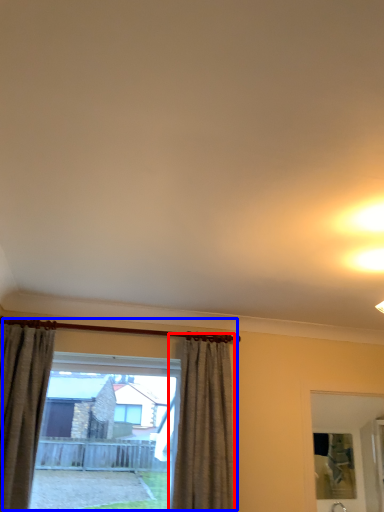
Question: Which object is closer to the camera taking this photo, curtain (highlighted by a red box) or window (highlighted by a blue box)?

Choices:
 (A) curtain
 (B) window

Answer: (A)